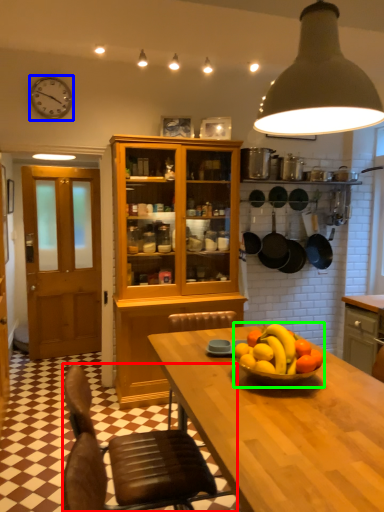
Question: Estimate the real-world distances between objects in this image. Which object is farther from chair (highlighted by a red box), clock (highlighted by a blue box) or fruit dish (highlighted by a green box)?

Choices:
 (A) clock
 (B) fruit dish

Answer: (A)